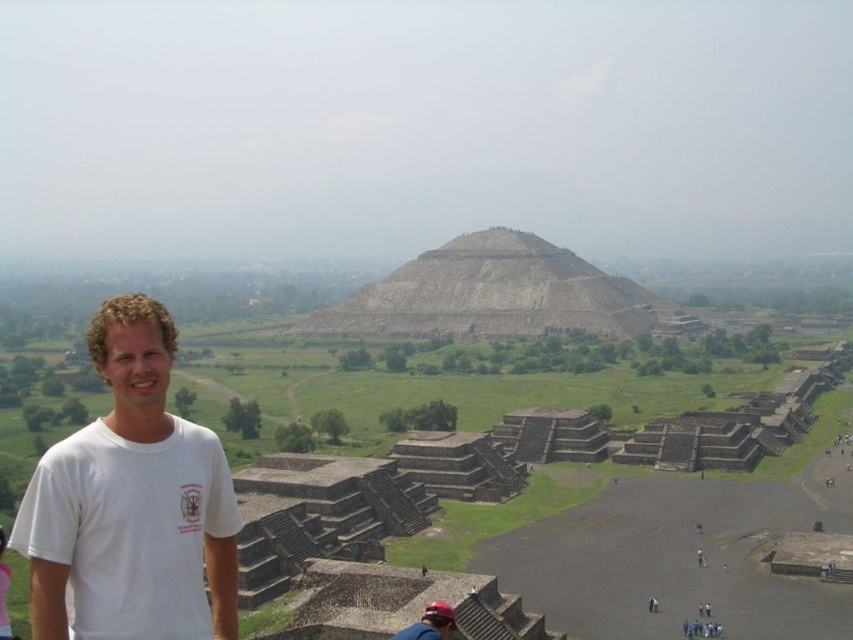
Looking at this image, can you confirm if white cotton t-shirt at left is bigger than stone textured pyramid at center?

No.

Does point (83, 596) come farther from viewer compared to point (560, 310)?

No.

You are a GUI agent. You are given a task and a screenshot of the screen. Output one action in this format:
    pyautogui.click(x=<x>, y=<y>)
    Task: Click on the white cotton t-shirt at left
    Image resolution: width=853 pixels, height=640 pixels.
    Given the screenshot: What is the action you would take?
    pyautogui.click(x=131, y=502)